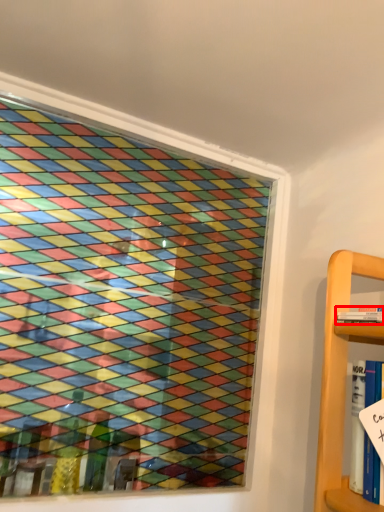
Question: From the image, what is the correct spatial relationship of book (annotated by the red box) in relation to book?

Choices:
 (A) right
 (B) left

Answer: (A)